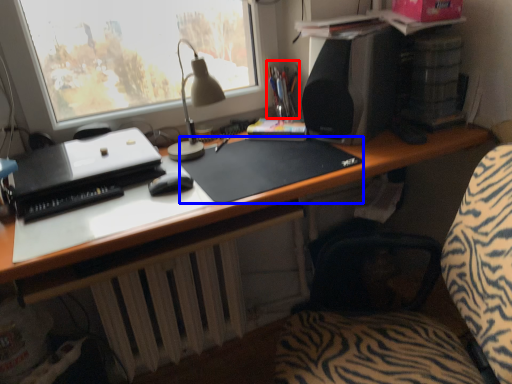
Question: Which point is closer to the camera, stationery (highlighted by a red box) or mousepad (highlighted by a blue box)?

Choices:
 (A) stationery
 (B) mousepad

Answer: (B)